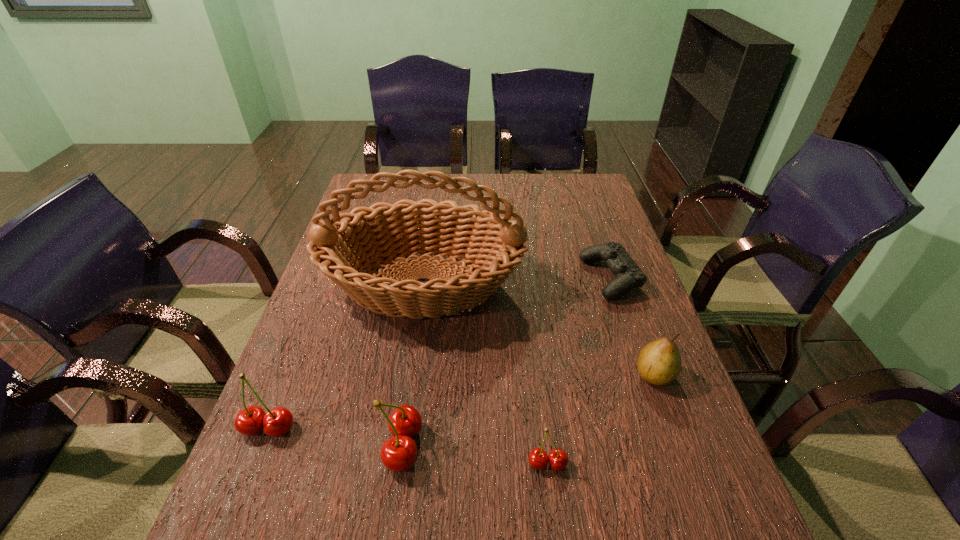
I want to click on the leftmost cherry, so click(251, 420).

Find the location of `the second shortest cherry`. the second shortest cherry is located at coordinates (251, 420).

Locate an element on the screen. This screenshot has height=540, width=960. the second cherry from left to right is located at coordinates (398, 453).

Where is `the shortest cherry`? This screenshot has height=540, width=960. the shortest cherry is located at coordinates (538, 458).

You are a GUI agent. You are given a task and a screenshot of the screen. Output one action in this format:
    pyautogui.click(x=<x>, y=<y>)
    Task: Click on the rightmost cherry
    The width and height of the screenshot is (960, 540).
    Given the screenshot: What is the action you would take?
    pyautogui.click(x=538, y=458)

Where is `basket`? This screenshot has height=540, width=960. basket is located at coordinates (390, 231).

At what (x,y) coordinates should I click in order to perform the action: click on the shortest object. Please return your answer as a coordinate pair (x, y). Looking at the image, I should click on (628, 275).

The width and height of the screenshot is (960, 540). I want to click on the third farthest object, so click(659, 362).

The width and height of the screenshot is (960, 540). Identify the location of pear. tap(659, 362).

Identify the location of vacant space situated 0.050m with the stems of the second shortest cherry pointing upwards. Image resolution: width=960 pixels, height=540 pixels. (253, 467).